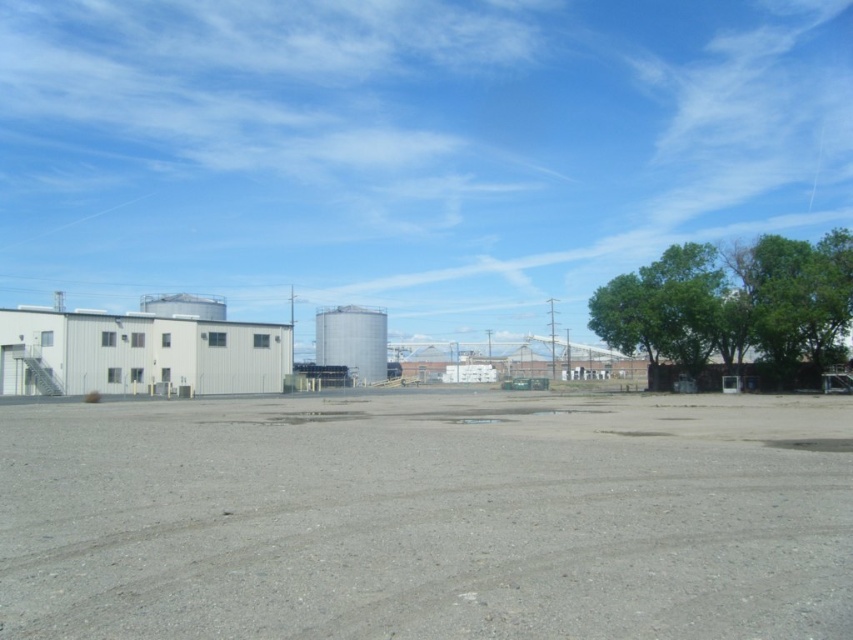
You are standing at the center of the gravelly area in the open industrial area. You see a green leafy tree at right represented by point (732, 304). Which direction should you walk to reach the tree?

The green leafy tree at right is located at point (732, 304), so you should walk towards the right side of the image to reach it.